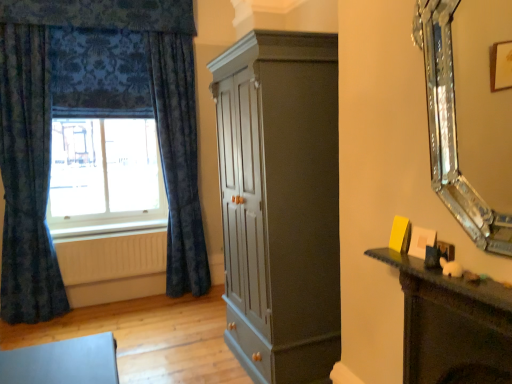
Locate an element on the screen. This screenshot has height=384, width=512. free space underneath silver/glass mirror at right (from a real-world perspective) is located at coordinates (472, 271).